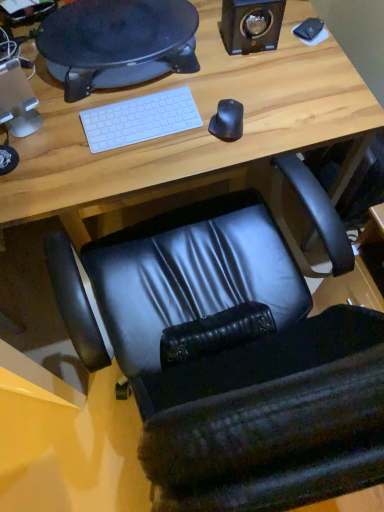
Identify the location of empty space that is ontop of matte black chair at lower center (from a real-world perspective). (164, 96).